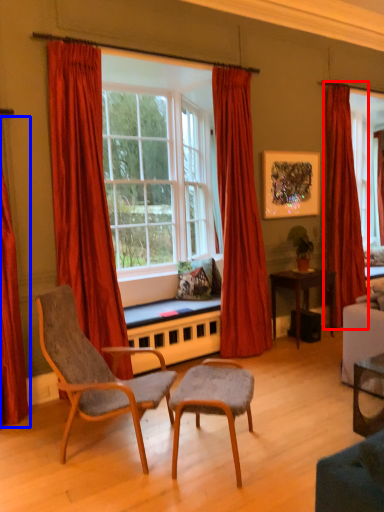
Question: Which point is further to the camera, curtain (highlighted by a red box) or curtain (highlighted by a blue box)?

Choices:
 (A) curtain
 (B) curtain

Answer: (A)